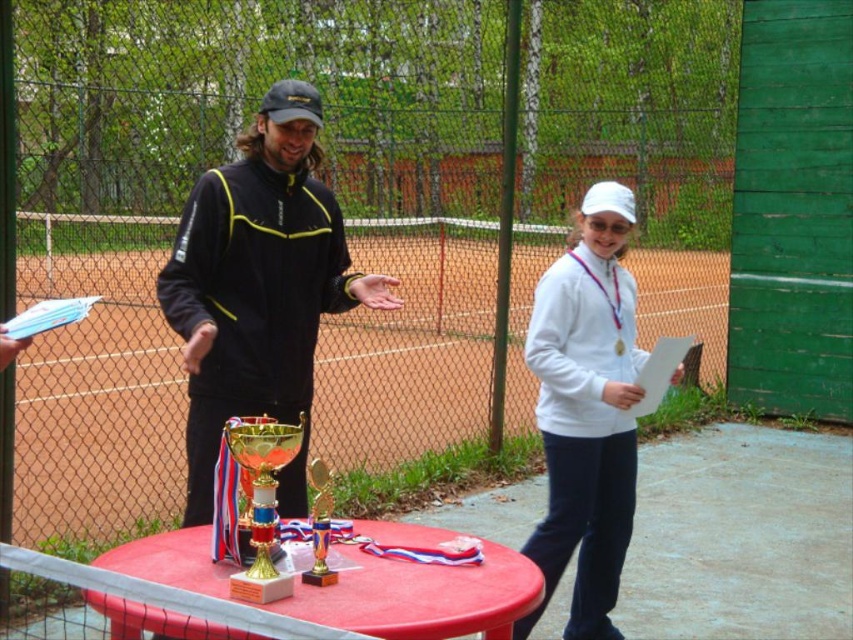
Question: Can you confirm if black softshell jacket at center is thinner than gold metallic trophy at center?

Choices:
 (A) yes
 (B) no

Answer: (B)

Question: Which point appears closest to the camera in this image?

Choices:
 (A) (370, 557)
 (B) (625, 429)

Answer: (A)

Question: Which point is closer to the camera?

Choices:
 (A) white matte jacket at center
 (B) gold metallic trophy at center
 (C) smooth plastic table at center
 (D) black softshell jacket at center

Answer: (C)

Question: In this image, where is white matte jacket at center located relative to gold metallic trophy at center?

Choices:
 (A) below
 (B) above

Answer: (A)

Question: Does white matte jacket at center have a lesser width compared to gold metallic trophy at center?

Choices:
 (A) no
 (B) yes

Answer: (A)

Question: Which is farther from the gold metallic trophy at center?

Choices:
 (A) white matte jacket at center
 (B) smooth plastic table at center

Answer: (A)